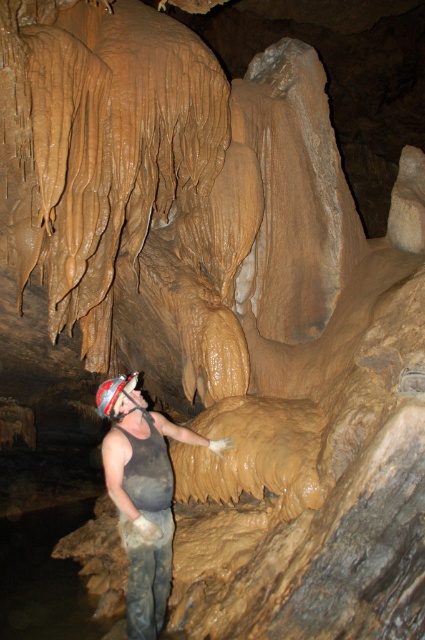
Between matte gray tank top at center and shiny silver helmet at center, which one is positioned lower?

Positioned lower is matte gray tank top at center.

Is point (161, 440) less distant than point (133, 387)?

No, (161, 440) is behind (133, 387).

Identify the location of matte gray tank top at center. (142, 496).